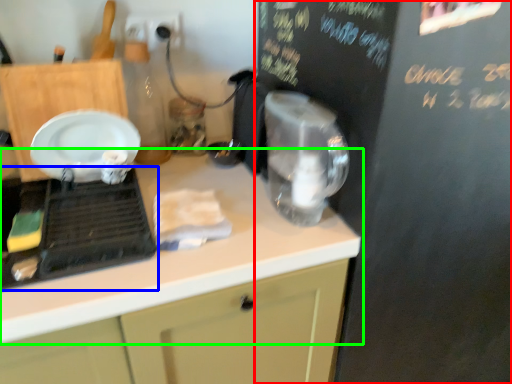
Question: Which is farther away from bulletin board (highlighted by a red box)? home appliance (highlighted by a blue box) or countertop (highlighted by a green box)?

Choices:
 (A) home appliance
 (B) countertop

Answer: (A)